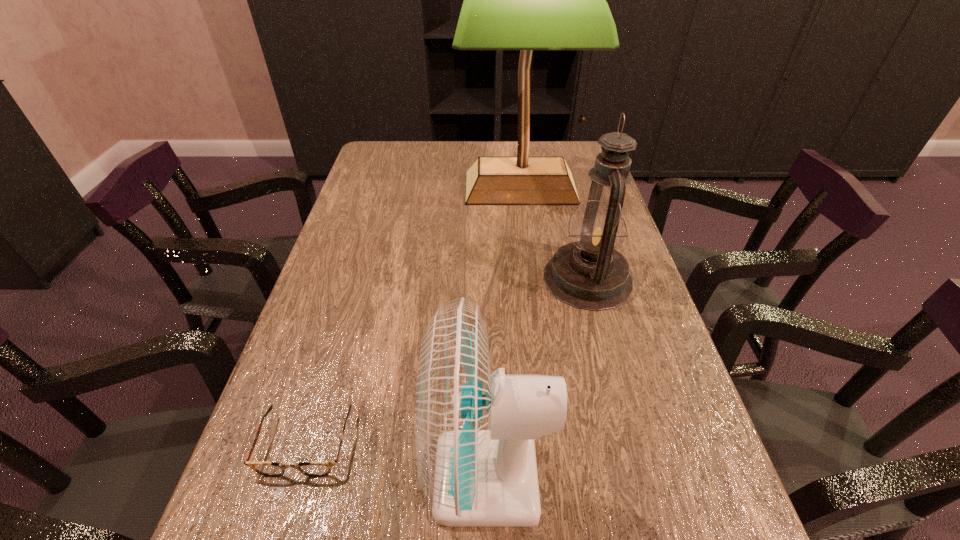
The image size is (960, 540). What are the coordinates of `table lamp located at the right edge` in the screenshot? It's located at (526, 0).

The image size is (960, 540). I want to click on oil lamp present at the right edge, so click(x=590, y=274).

Locate an element on the screen. The width and height of the screenshot is (960, 540). object positioned at the far right corner is located at coordinates (526, 0).

Image resolution: width=960 pixels, height=540 pixels. In the image, there is a desktop. Identify the location of vacant space at the far edge. (504, 147).

This screenshot has height=540, width=960. I want to click on vacant point at the left edge, so click(365, 251).

In the image, there is a desktop. Where is `vacant space at the right edge`? This screenshot has height=540, width=960. vacant space at the right edge is located at coordinates (683, 515).

The height and width of the screenshot is (540, 960). I want to click on vacant space at the far left corner of the desktop, so click(x=387, y=166).

Locate an element on the screen. This screenshot has height=540, width=960. vacant area between the tallest object and the leftmost object is located at coordinates (413, 315).

Point out which object is positioned as the nearest to the oil lamp. Please provide its 2D coordinates. Your answer should be formatted as a tuple, i.e. [(x, y)], where the tuple contains the x and y coordinates of a point satisfying the conditions above.

[(526, 0)]

Find the location of a particular element. the closest object relative to the fan is located at coordinates (273, 469).